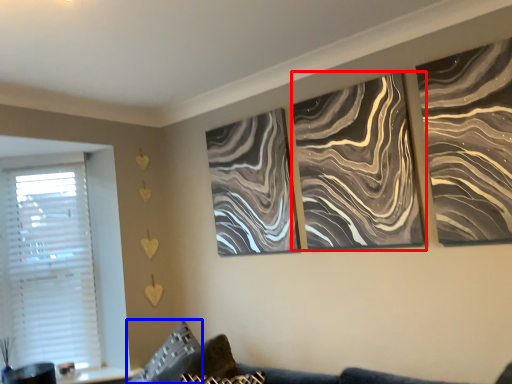
Question: Which object appears closest to the camera in this image, canvas (highlighted by a red box) or pillow (highlighted by a blue box)?

Choices:
 (A) canvas
 (B) pillow

Answer: (B)